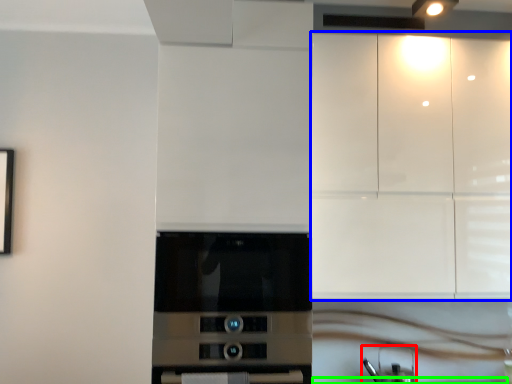
Question: Which is farther away from appliance (highlighted by a red box)? cabinetry (highlighted by a blue box) or counter top (highlighted by a green box)?

Choices:
 (A) cabinetry
 (B) counter top

Answer: (A)